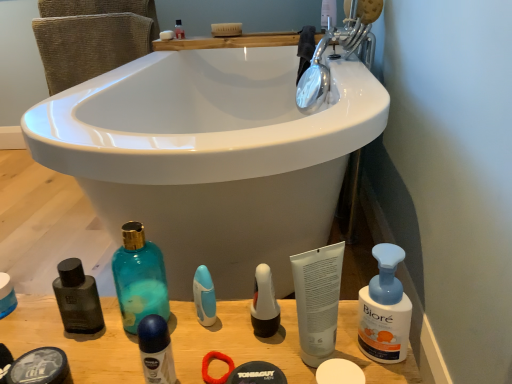
Question: Considering the relative sizes of white matte soap at lower center, the second soap viewed from the top, and white matte soap at upper center, which is counted as the first soap, starting from the back, in the image provided, is white matte soap at lower center, the second soap viewed from the top, smaller than white matte soap at upper center, which is counted as the first soap, starting from the back,?

Choices:
 (A) yes
 (B) no

Answer: (B)

Question: Considering the relative positions of white matte soap at lower center, which is counted as the 2th soap, starting from the left, and white matte soap at upper center, which is the second soap from front to back, in the image provided, is white matte soap at lower center, which is counted as the 2th soap, starting from the left, to the right of white matte soap at upper center, which is the second soap from front to back, from the viewer's perspective?

Choices:
 (A) no
 (B) yes

Answer: (B)

Question: Is white matte soap at lower center, which appears as the second soap when viewed from the back, thinner than white matte soap at upper center, which is the second soap from front to back?

Choices:
 (A) no
 (B) yes

Answer: (A)

Question: Are white matte soap at lower center, which appears as the second soap when viewed from the back, and white matte soap at upper center, marked as the 2th soap in a bottom-to-top arrangement, located far from each other?

Choices:
 (A) yes
 (B) no

Answer: (A)

Question: Is white matte soap at lower center, positioned as the 1th soap in right-to-left order, outside white matte soap at upper center, arranged as the 2th soap when viewed from the right?

Choices:
 (A) yes
 (B) no

Answer: (A)

Question: Is point (66, 375) closer or farther from the camera than point (274, 297)?

Choices:
 (A) farther
 (B) closer

Answer: (B)

Question: In terms of size, does matte black shaving cream at lower left, which appears as the first toiletry when ordered from the bottom, appear bigger or smaller than white glossy pump bottle at center, the 4th toiletry from the bottom?

Choices:
 (A) small
 (B) big

Answer: (B)

Question: Based on their positions, is matte black shaving cream at lower left, which appears as the 5th toiletry when viewed from the right, located to the left or right of white glossy pump bottle at center, placed as the 5th toiletry when sorted from left to right?

Choices:
 (A) left
 (B) right

Answer: (A)

Question: Is matte black shaving cream at lower left, the second toiletry when ordered from left to right, wider or thinner than white glossy pump bottle at center, the 2th toiletry viewed from the right?

Choices:
 (A) wide
 (B) thin

Answer: (A)

Question: Is blue matte deodorant at center, placed as the fifth toiletry when sorted from top to bottom, wider or thinner than blue plastic toothbrush at center, which appears as the 4th toiletry when viewed from the left?

Choices:
 (A) thin
 (B) wide

Answer: (B)

Question: Considering the positions of blue matte deodorant at center, the 2th toiletry from the front, and blue plastic toothbrush at center, the third toiletry in the bottom-to-top sequence, in the image, is blue matte deodorant at center, the 2th toiletry from the front, taller or shorter than blue plastic toothbrush at center, the third toiletry in the bottom-to-top sequence,?

Choices:
 (A) short
 (B) tall

Answer: (A)

Question: Would you say blue matte deodorant at center, acting as the fifth toiletry starting from the back, is to the left or to the right of blue plastic toothbrush at center, acting as the fourth toiletry starting from the top, in the picture?

Choices:
 (A) right
 (B) left

Answer: (B)

Question: From a real-world perspective, is blue matte deodorant at center, placed as the fifth toiletry when sorted from top to bottom, above or below blue plastic toothbrush at center, arranged as the 5th toiletry when viewed from the front?

Choices:
 (A) below
 (B) above

Answer: (B)

Question: Is white glossy pump bottle at center, the third toiletry viewed from the back, in front of or behind teal glass bottle at lower left, the first cleaning product viewed from the left, in the image?

Choices:
 (A) front
 (B) behind

Answer: (B)

Question: Choose the correct answer: Is white glossy pump bottle at center, the 4th toiletry from the bottom, inside teal glass bottle at lower left, positioned as the second cleaning product in right-to-left order, or outside it?

Choices:
 (A) inside
 (B) outside

Answer: (B)